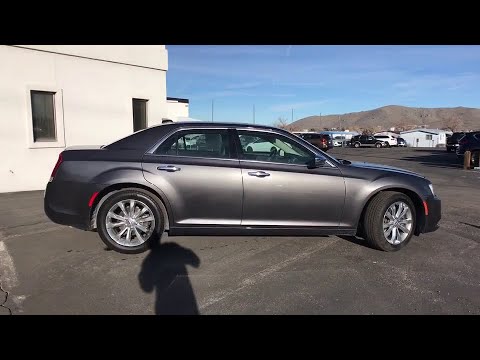
You are a GUI agent. You are given a task and a screenshot of the screen. Output one action in this format:
    pyautogui.click(x=<x>, y=<y>)
    Task: Click on the chrome trim
    The width and height of the screenshot is (480, 360).
    Given the screenshot: What is the action you would take?
    pyautogui.click(x=153, y=147)